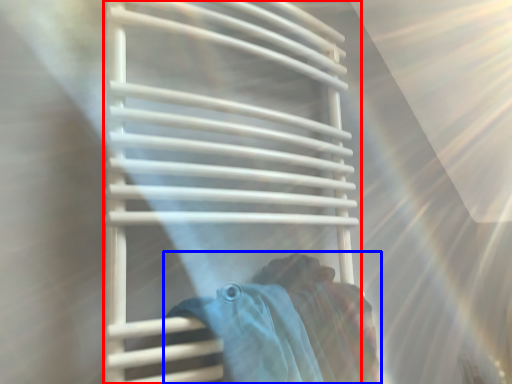
Question: Which object appears farthest to the camera in this image, towel rack (highlighted by a red box) or woman (highlighted by a blue box)?

Choices:
 (A) towel rack
 (B) woman

Answer: (B)